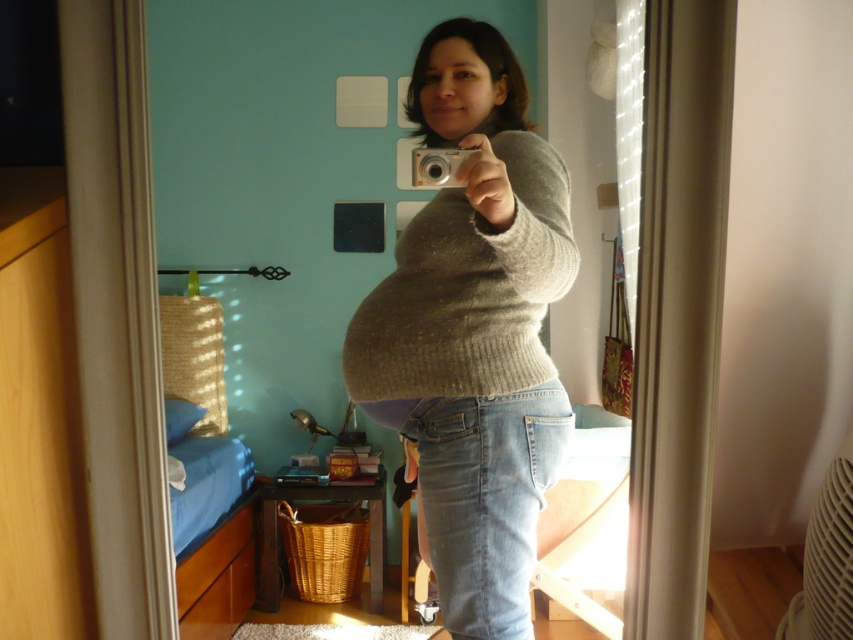
Is point (433, 200) behind point (373, 416)?

No.

Between knitted sweater at center and matte beige sweater at center, which one is positioned higher?

knitted sweater at center is above.

You are a GUI agent. You are given a task and a screenshot of the screen. Output one action in this format:
    pyautogui.click(x=<x>, y=<y>)
    Task: Click on the knitted sweater at center
    The height and width of the screenshot is (640, 853).
    Given the screenshot: What is the action you would take?
    pyautogui.click(x=474, y=332)

Measure the distance between knitted sweater at center and knit gray sweater at center.

1.60 inches

Is knitted sweater at center wider than knit gray sweater at center?

In fact, knitted sweater at center might be narrower than knit gray sweater at center.

Where is `knitted sweater at center`? knitted sweater at center is located at coordinates (474, 332).

Locate an element on the screen. Image resolution: width=853 pixels, height=640 pixels. knitted sweater at center is located at coordinates (474, 332).

Is gray knitted sweater at center closer to the viewer compared to knit gray sweater at center?

No, it is not.

Which is more to the right, gray knitted sweater at center or knit gray sweater at center?

Positioned to the right is knit gray sweater at center.

Between point (280, 61) and point (520, 296), which one is positioned behind?

Point (280, 61)

Find the location of a particular element. Image resolution: width=853 pixels, height=640 pixels. gray knitted sweater at center is located at coordinates (289, 176).